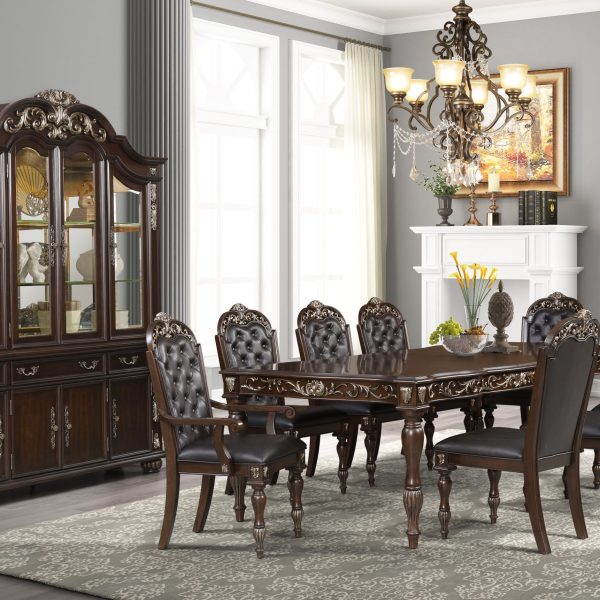
Find the location of a particular element. Image resolution: width=600 pixels, height=600 pixels. ceiling lights is located at coordinates (400, 79), (419, 88), (451, 72), (485, 92), (514, 77), (534, 90).